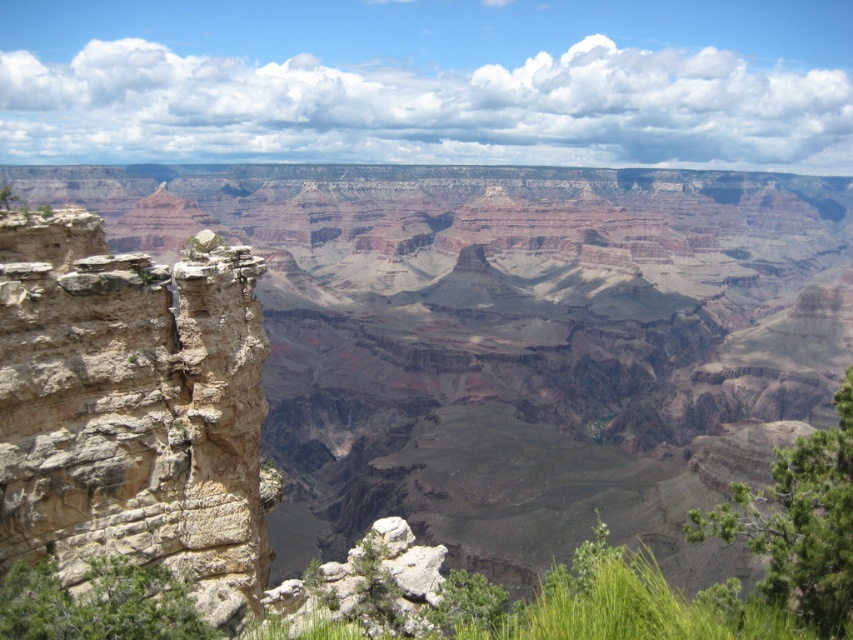
You are a hiker planning to take a photo of the rustic stone cliff at left and the brown rocky canyon at left from the observation deck. Which object should you focus on first if you want to capture both in a single frame without moving the camera?

You should focus on the brown rocky canyon at left first because the rustic stone cliff at left is behind it, so keeping the brown rocky canyon at left in the foreground will allow both objects to be in the frame simultaneously.

You are a hiker planning to cross from the brown rocky canyon at left to the rustic stone cliff at left. Based on their widths, which path would be more suitable for a wider hiking group?

The brown rocky canyon at left might be wider than rustic stone cliff at left, so the brown rocky canyon at left would be more suitable for a wider hiking group.

You are standing at the edge of the Grand Canyon and see the brown rocky canyon at left. What are the coordinates of its location in the image?

The coordinates of the brown rocky canyon at left are at point [514,340].